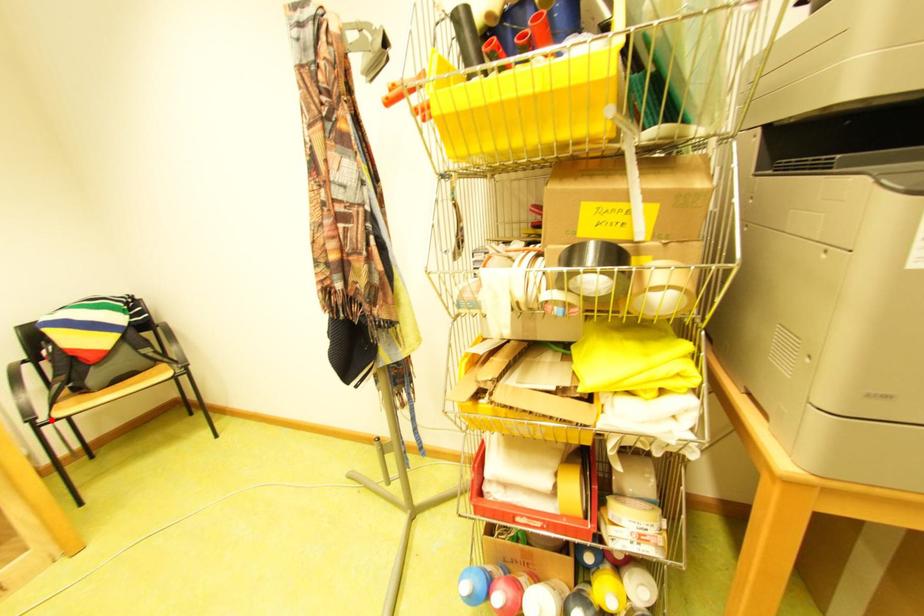
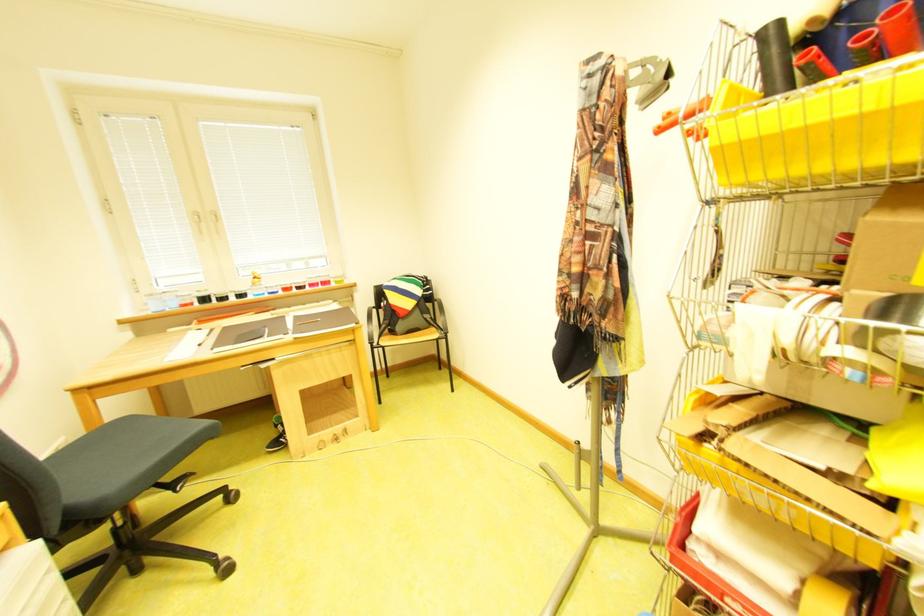
Where in the second image is the point corresponding to the highlighted location from the first image?

(385, 345)